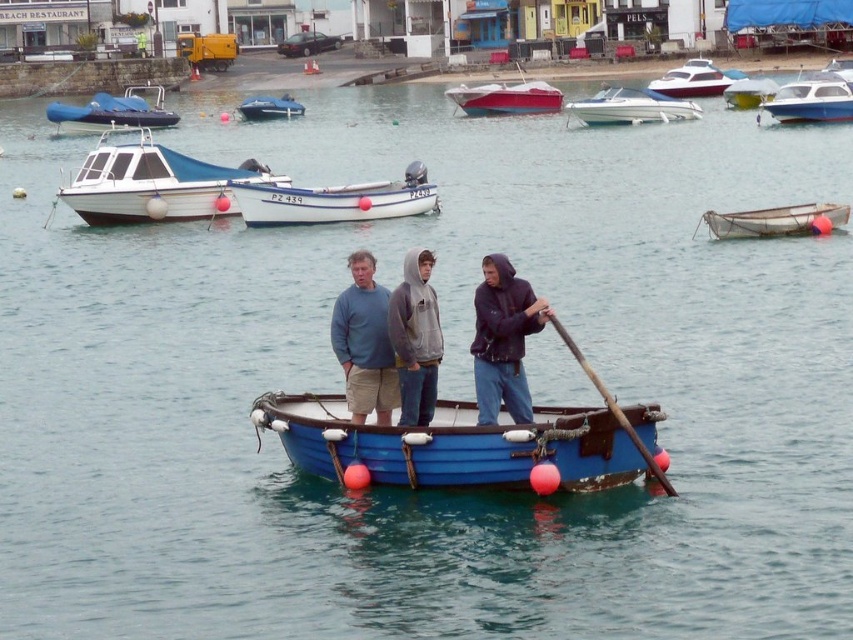
Can you confirm if blue wooden boat at center is positioned below yellow matte boat at center?

Indeed, blue wooden boat at center is positioned under yellow matte boat at center.

Is blue wooden boat at center to the left of yellow matte boat at center from the viewer's perspective?

Indeed, blue wooden boat at center is positioned on the left side of yellow matte boat at center.

Locate an element on the screen. This screenshot has width=853, height=640. blue wooden boat at center is located at coordinates coord(451,444).

Is white glossy speedboat at upper center smaller than wooden at center?

No, white glossy speedboat at upper center is not smaller than wooden at center.

Where is `white glossy speedboat at upper center`? white glossy speedboat at upper center is located at coordinates (631, 108).

The height and width of the screenshot is (640, 853). Find the location of `white glossy speedboat at upper center`. white glossy speedboat at upper center is located at coordinates (631, 108).

Does dark blue hooded sweatshirt at center lie behind rubber blue dinghy at upper left?

No, dark blue hooded sweatshirt at center is in front of rubber blue dinghy at upper left.

Who is more forward, [495,342] or [86,108]?

Point [495,342]

The image size is (853, 640). In order to click on dark blue hooded sweatshirt at center in this screenshot , I will do point(503,340).